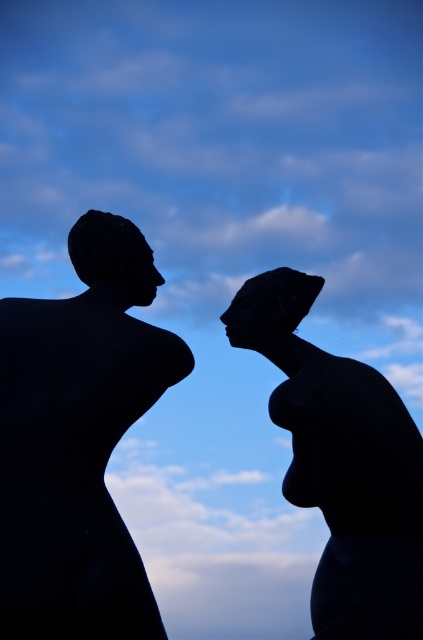
Measure the distance from black matte sculpture at center to black matte sculpture at left.

The distance of black matte sculpture at center from black matte sculpture at left is 1.64 meters.

Does point (365, 380) lie behind point (52, 321)?

Yes, point (365, 380) is behind point (52, 321).

Who is more forward, (35, 625) or (60, 365)?

Point (35, 625) is in front.

Locate an element on the screen. black matte sculpture at center is located at coordinates coord(77,440).

Between black matte sculpture at center and silhouette stone head at center, which one has more height?

With more height is black matte sculpture at center.

Is point (397, 616) farther from viewer compared to point (283, 371)?

No, (397, 616) is in front of (283, 371).

Who is more forward, (340, 579) or (313, 484)?

Point (313, 484)

I want to click on black matte sculpture at center, so click(x=77, y=440).

Can you confirm if black matte sculpture at left is bigger than silhouette stone head at center?

Indeed, black matte sculpture at left has a larger size compared to silhouette stone head at center.

Is point (2, 365) positioned in front of point (349, 538)?

Yes, point (2, 365) is closer to viewer.

Does point (96, 291) lie in front of point (351, 620)?

That is False.

The image size is (423, 640). In order to click on black matte sculpture at left in this screenshot , I will do `click(77, 440)`.